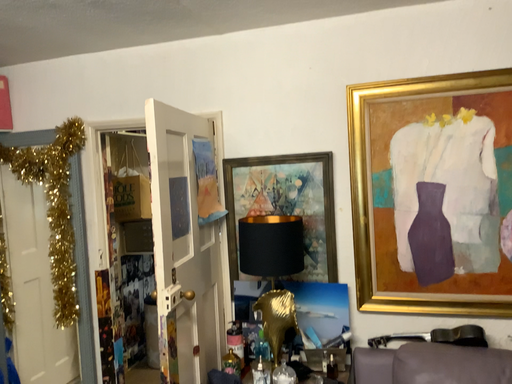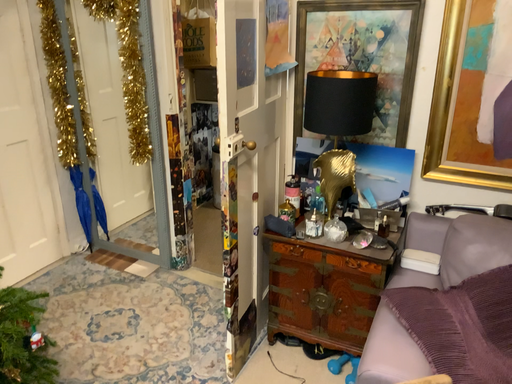
Question: How did the camera likely rotate when shooting the video?

Choices:
 (A) rotated downward
 (B) rotated upward

Answer: (A)